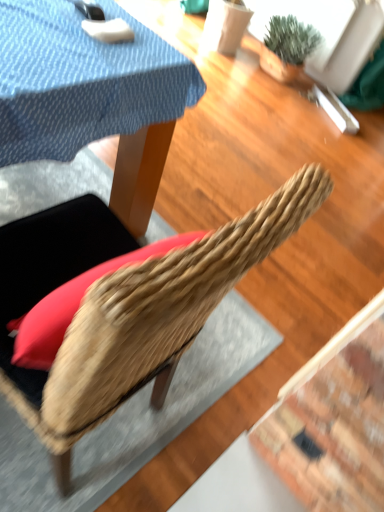
Question: Is woven wood chair at center wider than green textured plant at upper right?

Choices:
 (A) no
 (B) yes

Answer: (B)

Question: From the image's perspective, is woven wood chair at center under green textured plant at upper right?

Choices:
 (A) no
 (B) yes

Answer: (B)

Question: Is there a large distance between woven wood chair at center and green textured plant at upper right?

Choices:
 (A) yes
 (B) no

Answer: (A)

Question: Is woven wood chair at center oriented towards green textured plant at upper right?

Choices:
 (A) yes
 (B) no

Answer: (B)

Question: Can you confirm if woven wood chair at center is bigger than green textured plant at upper right?

Choices:
 (A) no
 (B) yes

Answer: (B)

Question: From a real-world perspective, is woven wood chair at center on top of green textured plant at upper right?

Choices:
 (A) yes
 (B) no

Answer: (A)

Question: Can you confirm if green textured plant at upper right is positioned to the right of woven wood chair at center?

Choices:
 (A) no
 (B) yes

Answer: (B)

Question: Is green textured plant at upper right beside woven wood chair at center?

Choices:
 (A) yes
 (B) no

Answer: (B)

Question: Can you confirm if green textured plant at upper right is thinner than woven wood chair at center?

Choices:
 (A) yes
 (B) no

Answer: (A)

Question: Are green textured plant at upper right and woven wood chair at center located far from each other?

Choices:
 (A) no
 (B) yes

Answer: (B)

Question: Is green textured plant at upper right completely or partially outside of woven wood chair at center?

Choices:
 (A) yes
 (B) no

Answer: (A)

Question: Considering the relative sizes of green textured plant at upper right and woven wood chair at center in the image provided, is green textured plant at upper right shorter than woven wood chair at center?

Choices:
 (A) no
 (B) yes

Answer: (B)

Question: Is woven wood chair at center to the left or to the right of green textured plant at upper right in the image?

Choices:
 (A) right
 (B) left

Answer: (B)